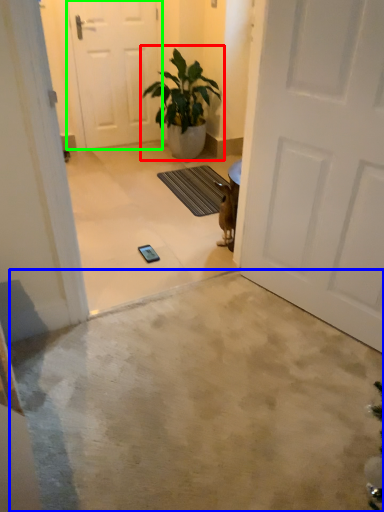
Question: Considering the real-world distances, which object is closest to houseplant (highlighted by a red box)? concrete (highlighted by a blue box) or door (highlighted by a green box).

Choices:
 (A) concrete
 (B) door

Answer: (B)